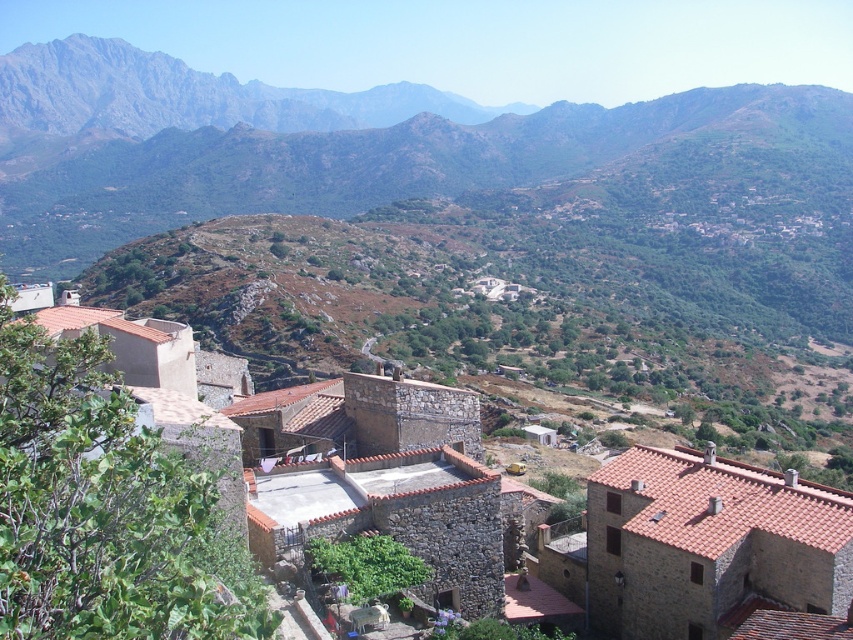
Question: Can you confirm if green grassy hillside at center is bigger than brown stone village at center?

Choices:
 (A) no
 (B) yes

Answer: (B)

Question: Among these objects, which one is nearest to the camera?

Choices:
 (A) brown stone village at center
 (B) green grassy hillside at center

Answer: (A)

Question: Can you confirm if green grassy hillside at center is smaller than brown stone village at center?

Choices:
 (A) yes
 (B) no

Answer: (B)

Question: Is green grassy hillside at center positioned in front of brown stone village at center?

Choices:
 (A) yes
 (B) no

Answer: (B)

Question: Which point is closer to the camera taking this photo?

Choices:
 (A) (728, 538)
 (B) (573, 282)

Answer: (A)